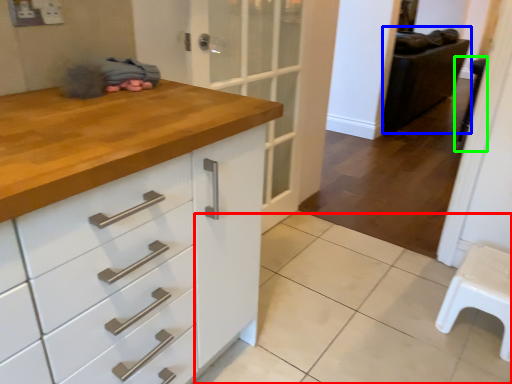
Question: Which is farther away from tile (highlighted by a red box)? chair (highlighted by a blue box) or step stool (highlighted by a green box)?

Choices:
 (A) chair
 (B) step stool

Answer: (A)